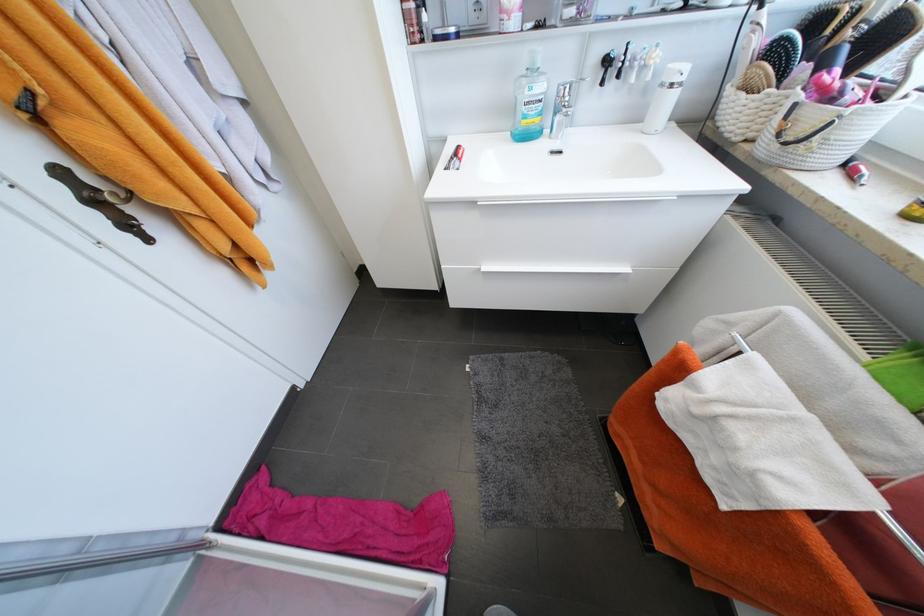
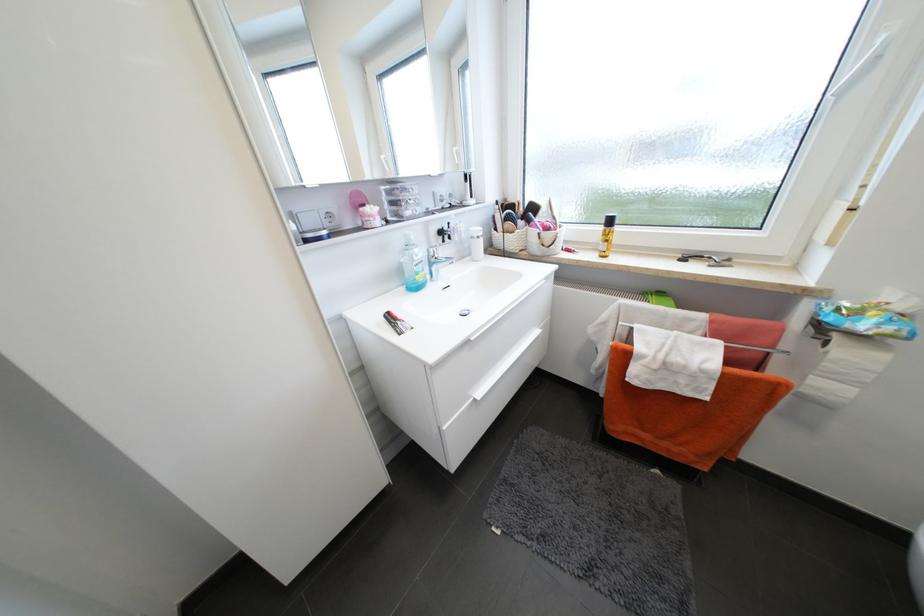
Question: I am providing you with two images of the same scene from different viewpoints. After the viewpoint changes to image2, which objects are now occluded?

Choices:
 (A) blue soap dispenser
 (B) soap dispenser pump
 (C) toilet paper roll
 (D) none of these

Answer: (D)